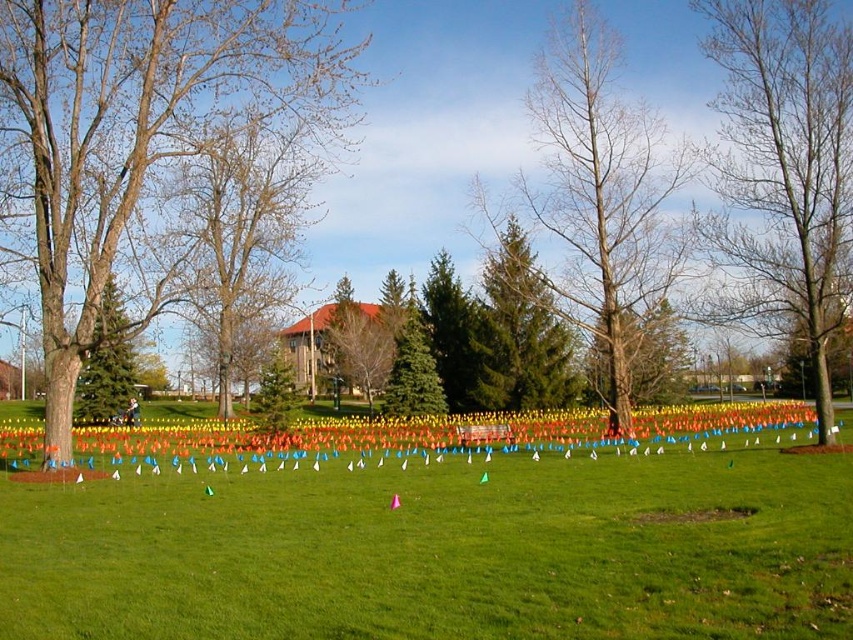
Question: Which of these objects is positioned farthest from the bare wood tree at center?

Choices:
 (A) bare wood tree at right
 (B) bare wood tree at left

Answer: (B)

Question: Can you confirm if bare wood tree at right is bigger than bare wood tree at center?

Choices:
 (A) no
 (B) yes

Answer: (A)

Question: Which object is closer to the camera taking this photo?

Choices:
 (A) brown bark tree at left
 (B) green matte tree at upper left
 (C) yellow fabric flags at center

Answer: (A)

Question: Can you confirm if bare wood tree at center is bigger than green matte tree at upper left?

Choices:
 (A) no
 (B) yes

Answer: (B)

Question: Can you confirm if bare wood tree at right is thinner than bare wood tree at left?

Choices:
 (A) no
 (B) yes

Answer: (B)

Question: Which point is farther to the camera?

Choices:
 (A) (78, 394)
 (B) (225, 340)
 (C) (810, 420)

Answer: (A)